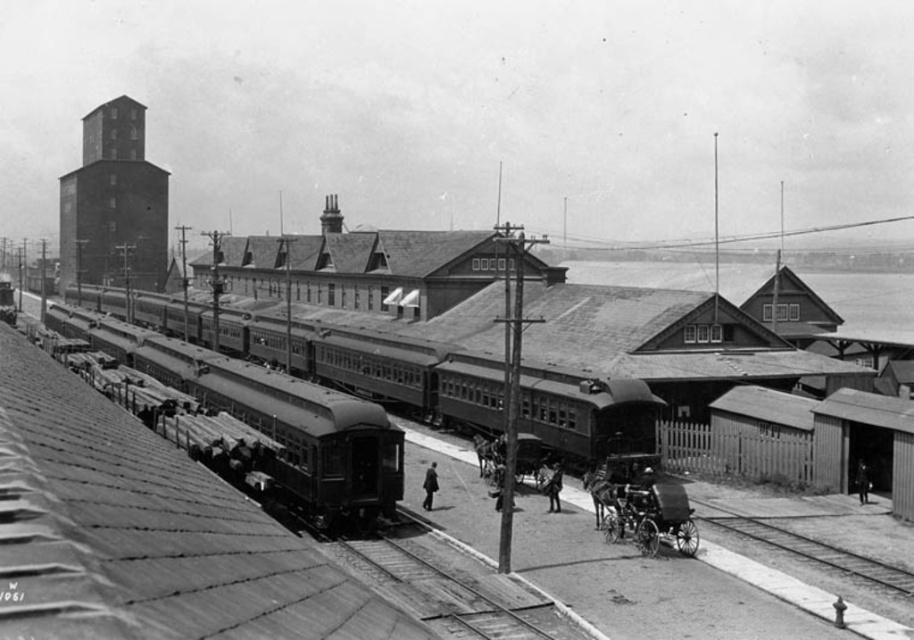
Question: Which of the following is the farthest from the observer?

Choices:
 (A) smooth wood track at lower right
 (B) dark clothing at center

Answer: (B)

Question: Is smooth metal train at center to the right of smooth wood track at lower right from the viewer's perspective?

Choices:
 (A) yes
 (B) no

Answer: (B)

Question: Which of the following is the closest to the observer?

Choices:
 (A) (857, 464)
 (B) (551, 508)

Answer: (B)

Question: Can you confirm if smooth wood track at lower right is smaller than smooth leather coat at center?

Choices:
 (A) no
 (B) yes

Answer: (B)

Question: Which point is closer to the camera taking this photo?

Choices:
 (A) (867, 476)
 (B) (328, 524)
 (C) (752, 534)

Answer: (B)

Question: From the image, what is the correct spatial relationship of smooth leather coat at center in relation to dark clothing at center?

Choices:
 (A) right
 (B) left

Answer: (B)